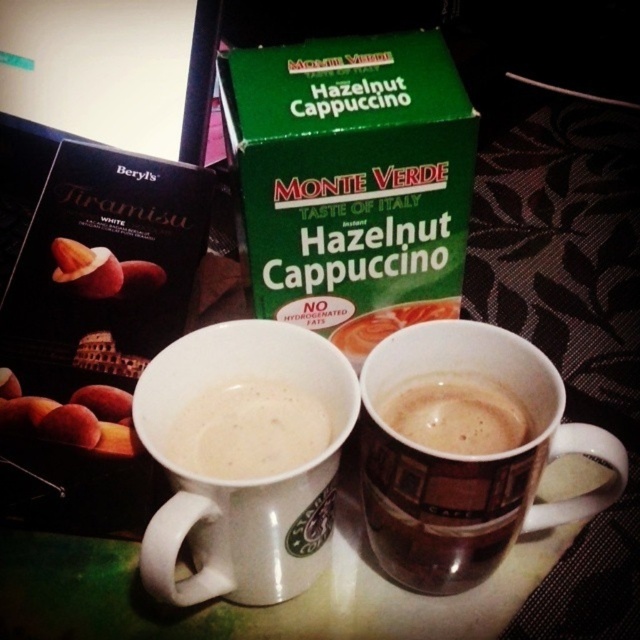
Question: From the image, what is the correct spatial relationship of green cardboard box at upper center in relation to brown matte cup at center?

Choices:
 (A) above
 (B) below

Answer: (A)

Question: Which object appears farthest from the camera in this image?

Choices:
 (A) white ceramic mug at center
 (B) brown ceramic mug at center
 (C) green cardboard box at upper center

Answer: (C)

Question: Which of the following is the farthest from the observer?

Choices:
 (A) brown ceramic mug at center
 (B) white ceramic mug at center
 (C) white matte mug at center

Answer: (C)

Question: Does green cardboard box at upper center have a greater width compared to brown matte cup at center?

Choices:
 (A) yes
 (B) no

Answer: (A)

Question: Does white matte mug at center have a greater width compared to brown matte cup at center?

Choices:
 (A) no
 (B) yes

Answer: (B)

Question: Which point is closer to the camera?

Choices:
 (A) (419, 579)
 (B) (248, 416)
 (C) (172, 532)

Answer: (C)